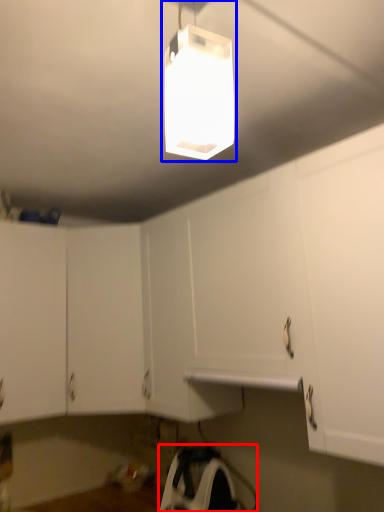
Question: Which of the following is the farthest to the observer, appliance (highlighted by a red box) or lamp (highlighted by a blue box)?

Choices:
 (A) appliance
 (B) lamp

Answer: (A)